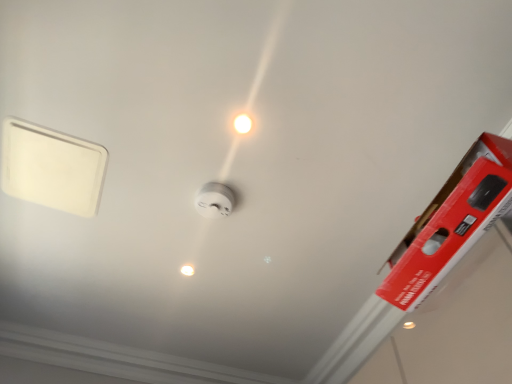
Question: From a real-world perspective, is white plastic smoke detector at center located beneath white glossy light bulb at center, the second light bulb viewed from the back?

Choices:
 (A) no
 (B) yes

Answer: (B)

Question: Considering the relative sizes of white plastic smoke detector at center and white glossy light bulb at center, the second light bulb viewed from the back, in the image provided, is white plastic smoke detector at center bigger than white glossy light bulb at center, the second light bulb viewed from the back,?

Choices:
 (A) yes
 (B) no

Answer: (A)

Question: Is white glossy light bulb at center, placed as the 2th light bulb when sorted from left to right, completely or partially inside white plastic smoke detector at center?

Choices:
 (A) no
 (B) yes

Answer: (A)

Question: Does white plastic smoke detector at center have a smaller size compared to white glossy light bulb at center, marked as the second light bulb in a bottom-to-top arrangement?

Choices:
 (A) no
 (B) yes

Answer: (A)

Question: From the image's perspective, would you say white plastic smoke detector at center is shown under white glossy light bulb at center, the second light bulb viewed from the back?

Choices:
 (A) yes
 (B) no

Answer: (A)

Question: In terms of size, does white plastic smoke detector at center appear bigger or smaller than white glossy light bulb at center, placed as the first light bulb when sorted from left to right?

Choices:
 (A) big
 (B) small

Answer: (A)

Question: Would you say white plastic smoke detector at center is inside or outside white glossy light bulb at center, placed as the first light bulb when sorted from left to right?

Choices:
 (A) outside
 (B) inside

Answer: (A)

Question: From the image's perspective, is white plastic smoke detector at center above or below white glossy light bulb at center, placed as the first light bulb when sorted from left to right?

Choices:
 (A) below
 (B) above

Answer: (B)

Question: Looking at their shapes, would you say white plastic smoke detector at center is wider or thinner than white glossy light bulb at center, which is the second light bulb in top-to-bottom order?

Choices:
 (A) wide
 (B) thin

Answer: (A)

Question: Visually, is white glossy light bulb at center, marked as the second light bulb in a bottom-to-top arrangement, positioned to the left or to the right of white glossy light bulb at center, arranged as the 1th light bulb when viewed from the back?

Choices:
 (A) right
 (B) left

Answer: (A)

Question: Considering the positions of white glossy light bulb at center, the 1th light bulb viewed from the top, and white glossy light bulb at center, acting as the second light bulb starting from the front, in the image, is white glossy light bulb at center, the 1th light bulb viewed from the top, bigger or smaller than white glossy light bulb at center, acting as the second light bulb starting from the front,?

Choices:
 (A) big
 (B) small

Answer: (A)

Question: Is white glossy light bulb at center, the second light bulb viewed from the back, wider or thinner than white glossy light bulb at center, which is counted as the 1th light bulb, starting from the bottom?

Choices:
 (A) thin
 (B) wide

Answer: (B)

Question: From a real-world perspective, is white glossy light bulb at center, the second light bulb viewed from the back, above or below white glossy light bulb at center, acting as the second light bulb starting from the front?

Choices:
 (A) below
 (B) above

Answer: (B)

Question: Is white glossy light bulb at center, placed as the first light bulb when sorted from left to right, bigger or smaller than white glossy light bulb at center, placed as the 2th light bulb when sorted from left to right?

Choices:
 (A) big
 (B) small

Answer: (B)

Question: In terms of width, does white glossy light bulb at center, acting as the second light bulb starting from the front, look wider or thinner when compared to white glossy light bulb at center, the first light bulb from the right?

Choices:
 (A) wide
 (B) thin

Answer: (B)